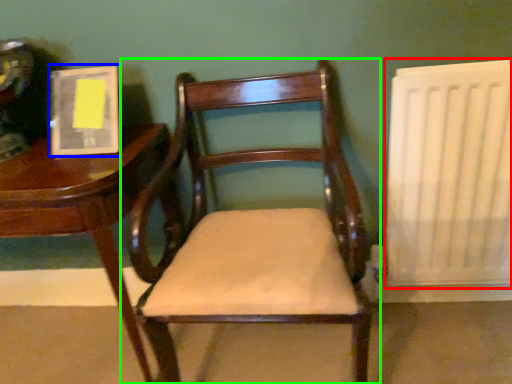
Question: Which object is positioned farthest from radiator (highlighted by a red box)? Select from book (highlighted by a blue box) and chair (highlighted by a green box).

Choices:
 (A) book
 (B) chair

Answer: (A)